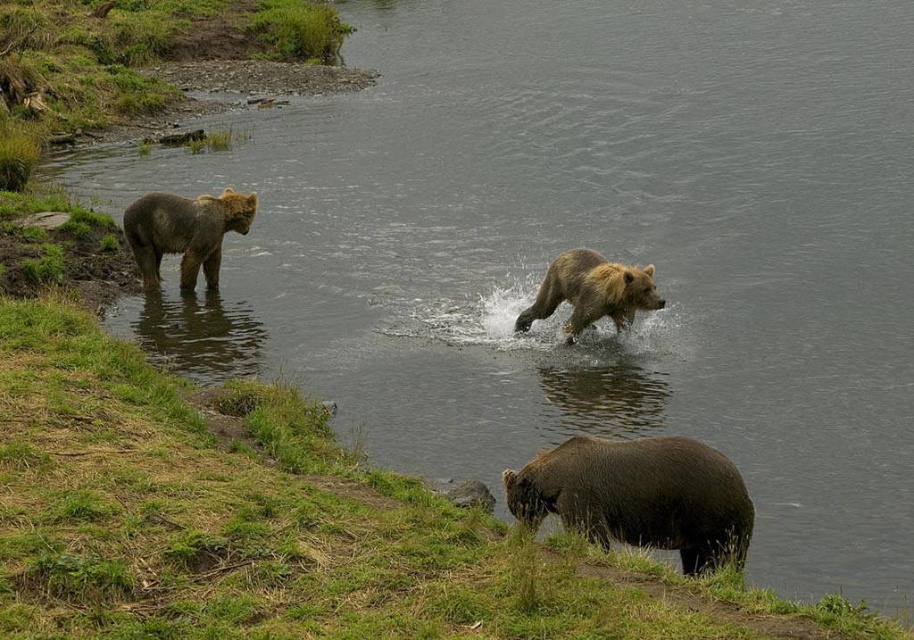
Does brown furry bear at left lie in front of brown fur bear at center?

No, brown furry bear at left is behind brown fur bear at center.

Can you confirm if brown furry bear at left is positioned to the right of brown fur bear at center?

No, brown furry bear at left is not to the right of brown fur bear at center.

The height and width of the screenshot is (640, 914). I want to click on brown furry bear at left, so click(x=184, y=232).

Is brown fur bear at lower right thinner than brown furry bear at left?

Indeed, brown fur bear at lower right has a lesser width compared to brown furry bear at left.

Is brown fur bear at lower right positioned in front of brown furry bear at left?

Yes, it is.

Does point (613, 502) come farther from viewer compared to point (158, 227)?

No, it is in front of (158, 227).

You are a GUI agent. You are given a task and a screenshot of the screen. Output one action in this format:
    pyautogui.click(x=<x>, y=<y>)
    Task: Click on the brown fur bear at lower right
    This screenshot has height=640, width=914.
    Given the screenshot: What is the action you would take?
    pyautogui.click(x=639, y=497)

Does brown fur bear at lower right have a smaller size compared to brown fur bear at center?

Yes, brown fur bear at lower right is smaller than brown fur bear at center.

Which is behind, point (639, 449) or point (585, 301)?

The point (585, 301) is more distant.

This screenshot has height=640, width=914. What are the coordinates of `brown fur bear at lower right` in the screenshot? It's located at (639, 497).